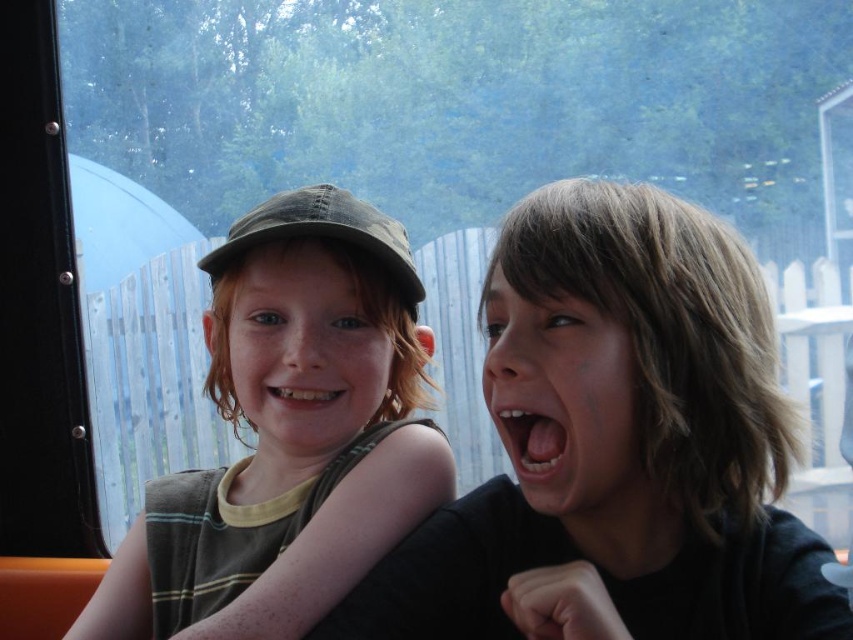
You are a photographer trying to capture a closeup of the white glossy teeth at center while ensuring the matte green cap at left is still visible in the frame. Based on their positions, can you fit both in the photo without moving the camera?

The matte green cap at left is positioned on the left side of white glossy teeth at center, so yes, the photographer can capture both the matte green cap at left and the white glossy teeth at center in the same frame without moving the camera.

You are a photographer trying to capture a closeup shot of both the matte green cap at left and the white glossy teeth at center in the image. Given the current spacing between them, can you fit both subjects into a frame that is 5 inches wide without moving either subject?

The distance between the matte green cap at left and the white glossy teeth at center is 5.29 inches. Since the frame is only 5 inches wide, it is not wide enough to capture both subjects without cropping one of them out.

Based on the photo, you are a photographer trying to capture a clear shot of both the matte black cap at upper left and the white glossy teeth at center in the image. Which object should you focus on first to ensure it appears sharp in the photo?

The matte black cap at upper left should be focused on first because it is taller than the white glossy teeth at center, making it more prominent in the frame.